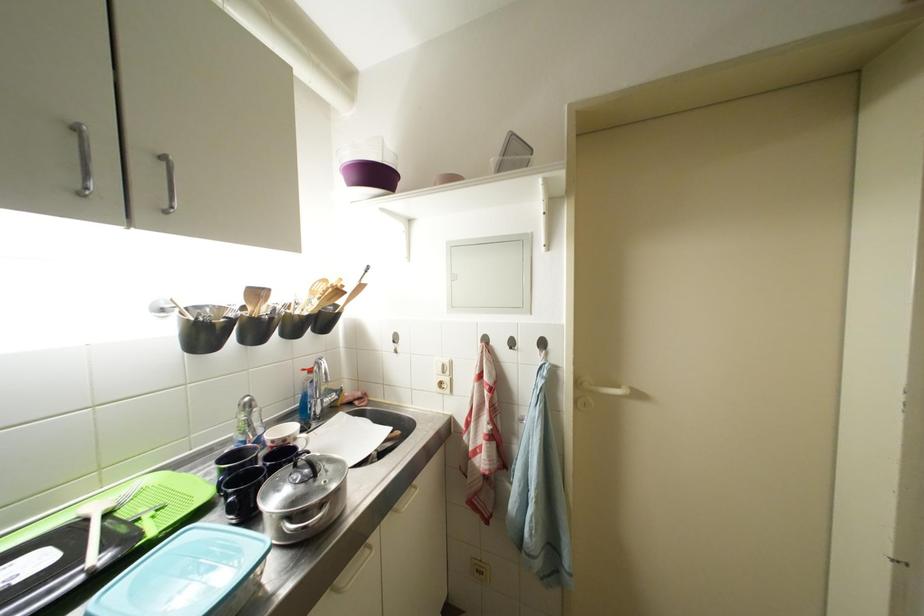
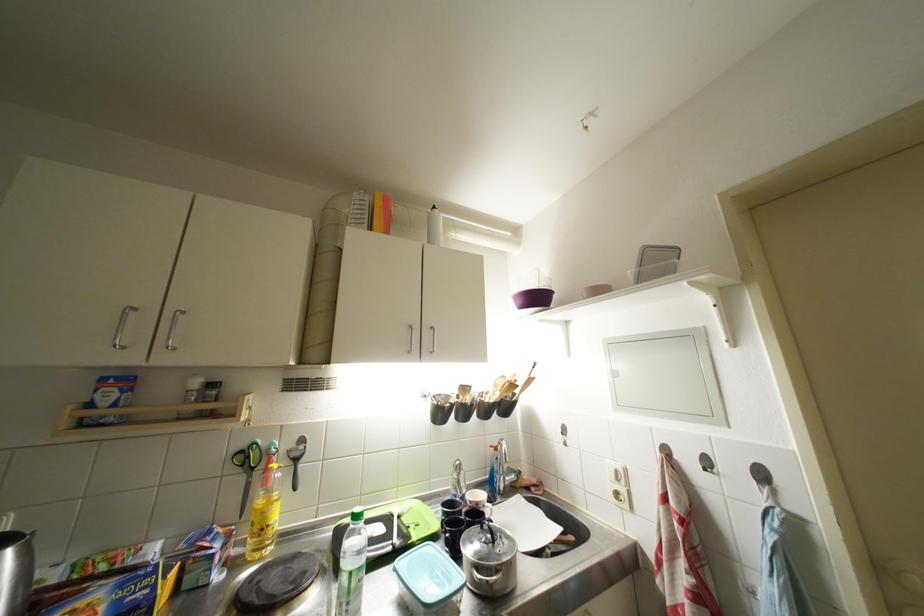
Locate, in the second image, the point that corresponds to (x=292, y=444) in the first image.

(483, 508)